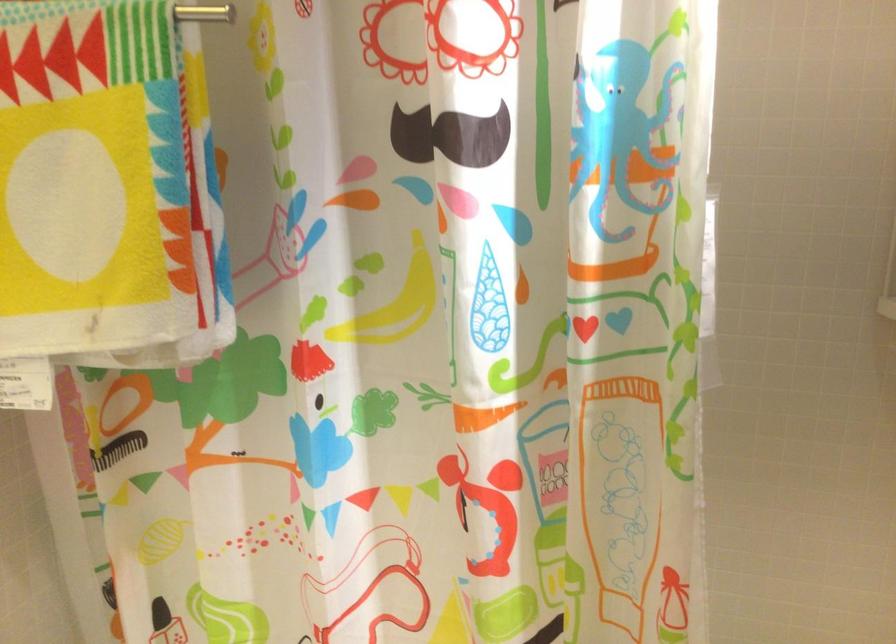
Where would you pull the white towel tag? Please return your answer as a coordinate pair (x, y).

(26, 384)